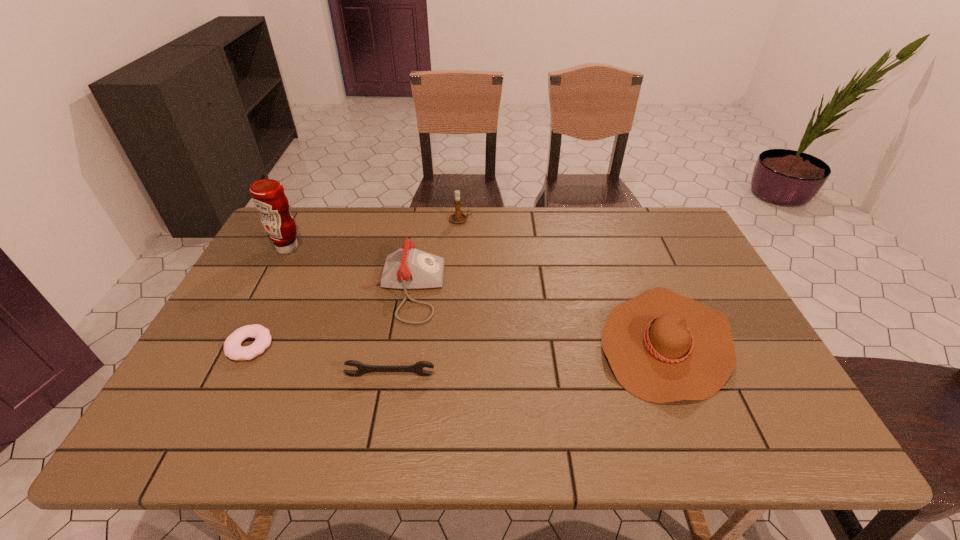
I want to click on the tallest object, so click(268, 196).

Find the location of `the second farthest object`. the second farthest object is located at coordinates (268, 196).

You are a GUI agent. You are given a task and a screenshot of the screen. Output one action in this format:
    pyautogui.click(x=<x>, y=<y>)
    Task: Click on the farthest object
    
    Given the screenshot: What is the action you would take?
    pyautogui.click(x=457, y=217)

Find the location of a particular element. the second object from right to left is located at coordinates (457, 217).

The image size is (960, 540). I want to click on the fourth shortest object, so click(408, 268).

You are a GUI agent. You are given a task and a screenshot of the screen. Output one action in this format:
    pyautogui.click(x=<x>, y=<y>)
    Task: Click on the rightmost object
    The image size is (960, 540).
    Given the screenshot: What is the action you would take?
    pyautogui.click(x=662, y=347)

Locate an element on the screen. Image resolution: width=960 pixels, height=540 pixels. cowboy hat is located at coordinates (662, 347).

Where is `the fifth tallest object`? The width and height of the screenshot is (960, 540). the fifth tallest object is located at coordinates (417, 368).

The width and height of the screenshot is (960, 540). Find the location of `doughnut`. doughnut is located at coordinates (232, 346).

Locate an element on the screen. This screenshot has width=960, height=540. vacant space located 0.170m on the front of the condiment is located at coordinates (263, 295).